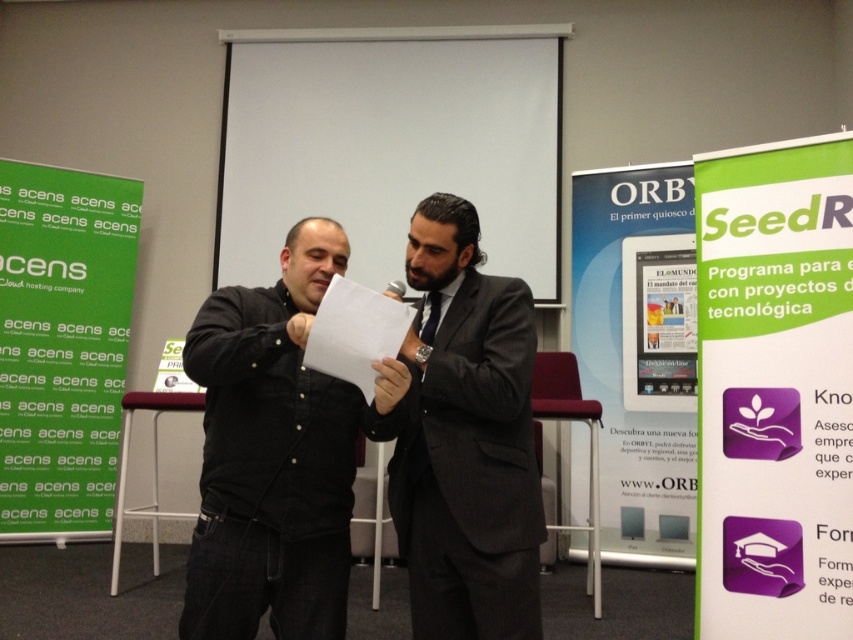
Question: Where is dark gray suit at center located in relation to white glossy tablet at center in the image?

Choices:
 (A) above
 (B) below

Answer: (B)

Question: Does green paper at upper right have a larger size compared to silky black tie at center?

Choices:
 (A) no
 (B) yes

Answer: (B)

Question: Considering the real-world distances, which object is farthest from the black corduroy shirt at center?

Choices:
 (A) blue glossy poster at center
 (B) dark gray suit at center

Answer: (A)

Question: Observing the image, what is the correct spatial positioning of black corduroy shirt at center in reference to blue glossy poster at center?

Choices:
 (A) right
 (B) left

Answer: (B)

Question: Which of these objects is positioned farthest from the green paper at upper right?

Choices:
 (A) black corduroy shirt at center
 (B) silky black tie at center
 (C) white paper at center

Answer: (A)

Question: Which of the following is the closest to the observer?

Choices:
 (A) green paper at left
 (B) green paper at upper right

Answer: (B)